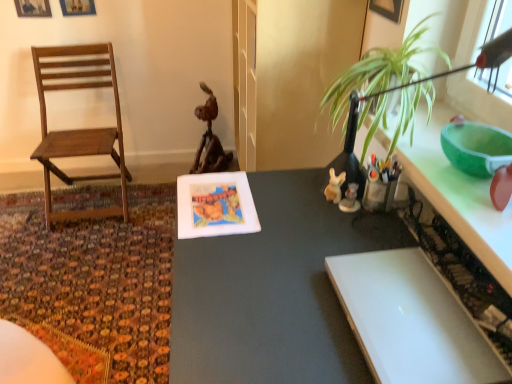
At what (x,y) coordinates should I click in order to perform the action: click on spots to the right of white glossy figurine at center-right, which is the second toy from left to right. Please return your answer as a coordinate pair (x, y). This screenshot has width=512, height=384. Looking at the image, I should click on (386, 216).